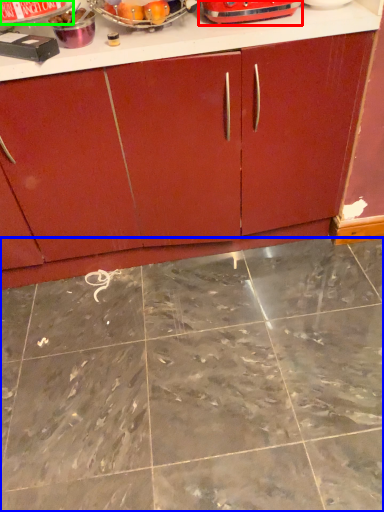
Question: Considering the real-world distances, which object is farthest from appliance (highlighted by a red box)? granite (highlighted by a blue box) or appliance (highlighted by a green box)?

Choices:
 (A) granite
 (B) appliance

Answer: (A)